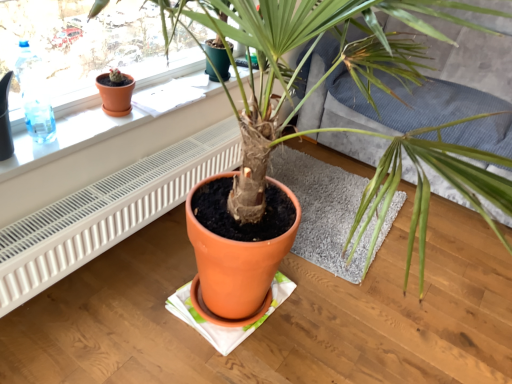
I want to click on free space that is in between matte orange flowerpot at upper left and transparent plastic bottle at upper left, so click(85, 121).